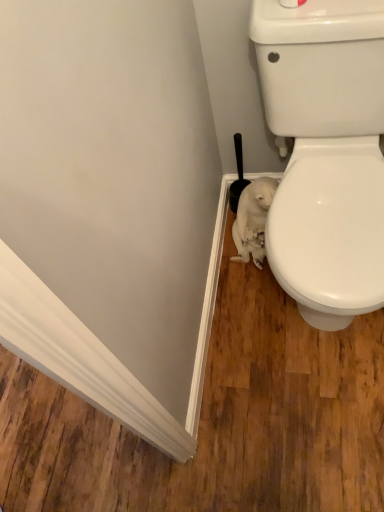
Question: From a real-world perspective, is black plastic brush at lower right beneath white fur animal at lower right?

Choices:
 (A) no
 (B) yes

Answer: (A)

Question: Is black plastic brush at lower right at the right side of white fur animal at lower right?

Choices:
 (A) no
 (B) yes

Answer: (A)

Question: Considering the relative sizes of black plastic brush at lower right and white fur animal at lower right in the image provided, is black plastic brush at lower right smaller than white fur animal at lower right?

Choices:
 (A) yes
 (B) no

Answer: (A)

Question: From the image's perspective, would you say black plastic brush at lower right is positioned over white fur animal at lower right?

Choices:
 (A) no
 (B) yes

Answer: (B)

Question: Is black plastic brush at lower right outside white fur animal at lower right?

Choices:
 (A) no
 (B) yes

Answer: (B)

Question: Is black plastic brush at lower right aimed at white fur animal at lower right?

Choices:
 (A) yes
 (B) no

Answer: (A)

Question: Is the depth of white fur animal at lower right greater than that of black plastic brush at lower right?

Choices:
 (A) no
 (B) yes

Answer: (A)

Question: Is white fur animal at lower right facing towards black plastic brush at lower right?

Choices:
 (A) no
 (B) yes

Answer: (A)

Question: From the image's perspective, is white fur animal at lower right located beneath black plastic brush at lower right?

Choices:
 (A) yes
 (B) no

Answer: (A)

Question: Is white fur animal at lower right turned away from black plastic brush at lower right?

Choices:
 (A) no
 (B) yes

Answer: (B)

Question: Is white fur animal at lower right taller than black plastic brush at lower right?

Choices:
 (A) no
 (B) yes

Answer: (A)

Question: From a real-world perspective, is white fur animal at lower right located beneath black plastic brush at lower right?

Choices:
 (A) no
 (B) yes

Answer: (B)

Question: Considering the positions of point (240, 154) and point (244, 215), is point (240, 154) closer or farther from the camera than point (244, 215)?

Choices:
 (A) farther
 (B) closer

Answer: (A)